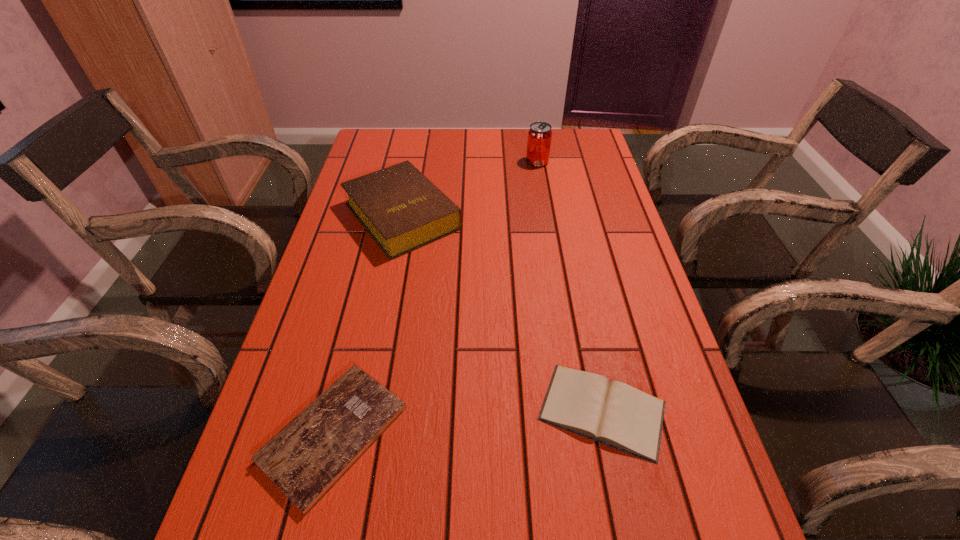
Find the location of a particular element. free space at the far edge is located at coordinates 511,158.

Find the location of a particular element. free space at the left edge of the desktop is located at coordinates (378, 282).

Identify the location of vacant space at the right edge of the desktop. (565, 193).

The height and width of the screenshot is (540, 960). I want to click on vacant area at the far left corner of the desktop, so click(x=403, y=158).

I want to click on free area in between the farthest Bible and the farthest object, so click(x=469, y=189).

Find the location of `unoccupied area between the pop soda and the rightmost Bible`. unoccupied area between the pop soda and the rightmost Bible is located at coordinates (570, 286).

This screenshot has height=540, width=960. Identify the location of unoccupied area between the tallest object and the farthest Bible. (469, 189).

Where is `vacant space that's between the rightmost Bible and the pop soda`? vacant space that's between the rightmost Bible and the pop soda is located at coordinates (570, 286).

The width and height of the screenshot is (960, 540). I want to click on free space between the tallest object and the rightmost Bible, so click(x=570, y=286).

This screenshot has width=960, height=540. In order to click on the second closest object to the tallest Bible in this screenshot , I will do `click(305, 459)`.